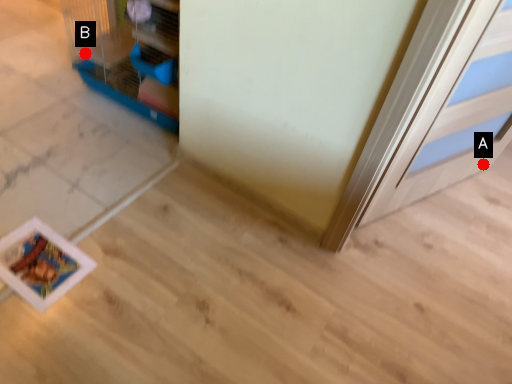
Question: Two points are circled on the image, labeled by A and B beside each circle. Which point is further to the camera?

Choices:
 (A) A is further
 (B) B is further

Answer: (B)